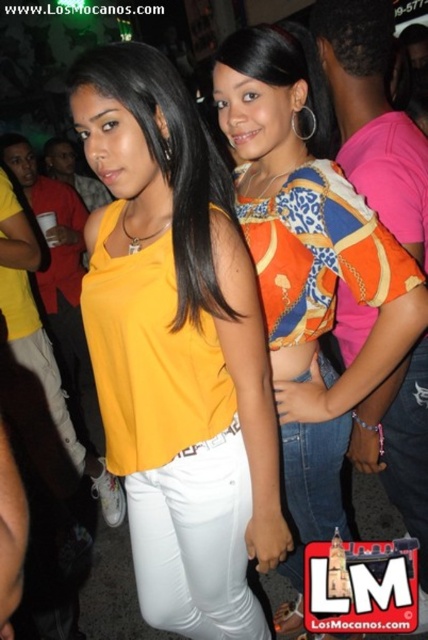
How distant is matte yellow blouse at center from orange printed blouse at center?

10.07 inches

Which is more to the left, matte yellow blouse at center or orange printed blouse at center?

Positioned to the left is matte yellow blouse at center.

You are a GUI agent. You are given a task and a screenshot of the screen. Output one action in this format:
    pyautogui.click(x=<x>, y=<y>)
    Task: Click on the matte yellow blouse at center
    Image resolution: width=428 pixels, height=640 pixels.
    Given the screenshot: What is the action you would take?
    [177, 349]